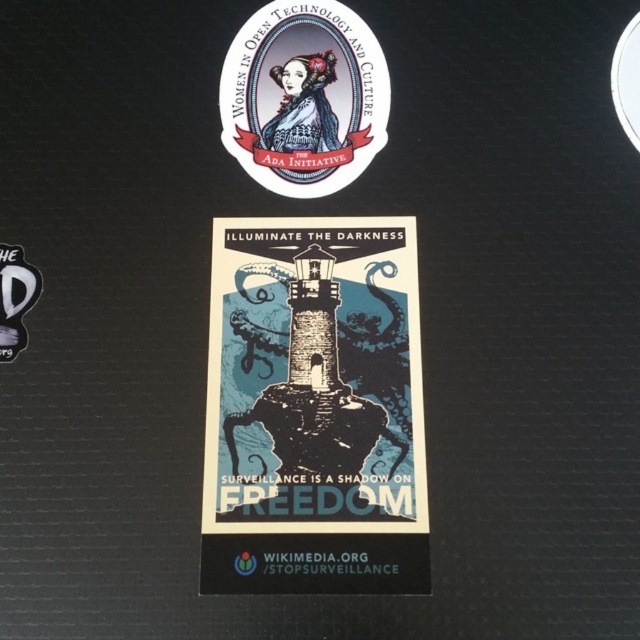
You are an art student analyzing the arrangement of stickers on a dark wall. You notice the matte paper sticker at upper center and the white fabric logo at lower left. Which sticker is positioned higher on the wall?

The matte paper sticker at upper center is positioned higher on the wall than the white fabric logo at lower left.